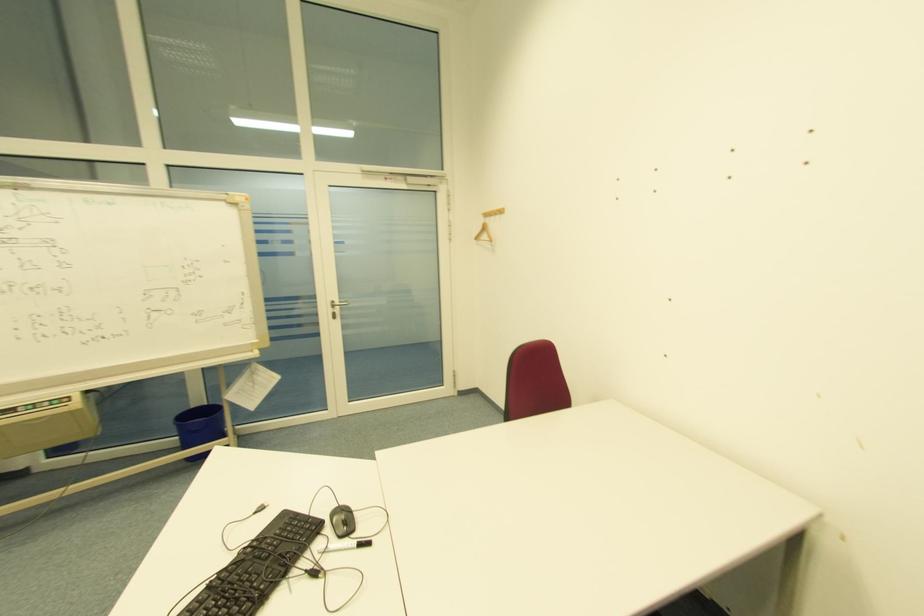
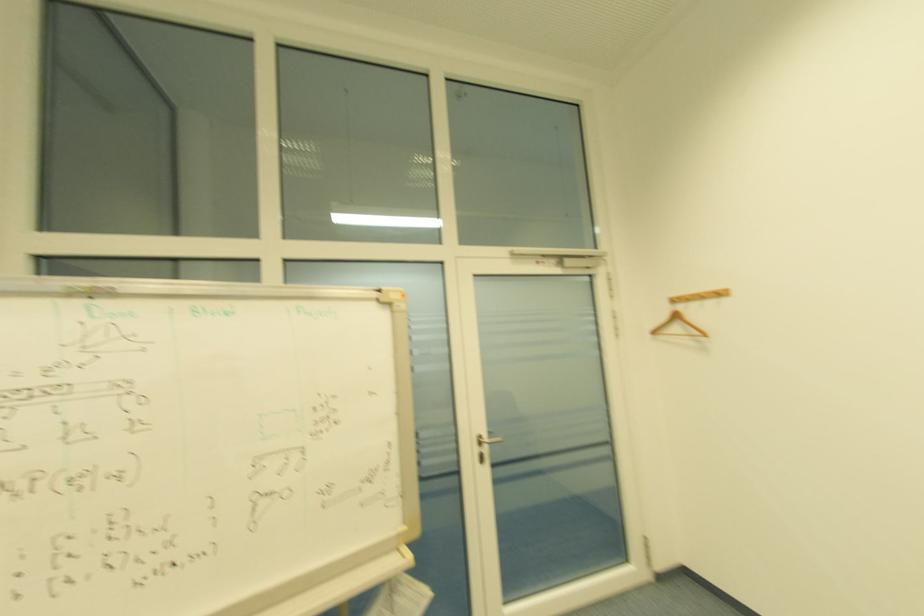
The images are taken continuously from a first-person perspective. In which direction are you moving?

The cameraman moved toward left, forward.